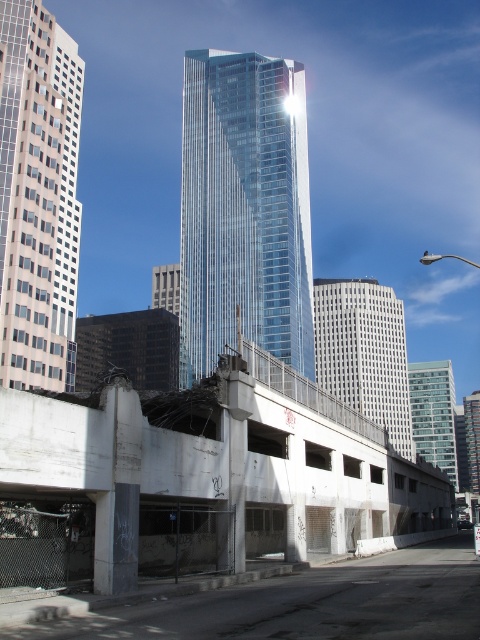
Question: Is concrete parking garage at center below white glass skyscraper at center?

Choices:
 (A) yes
 (B) no

Answer: (B)

Question: Which point is farther to the camera?

Choices:
 (A) (205, 132)
 (B) (435, 394)
 (C) (66, 128)
 (D) (71, 401)

Answer: (B)

Question: Is transparent glass skyscraper at center smaller than white glass skyscraper at center?

Choices:
 (A) yes
 (B) no

Answer: (A)

Question: Estimate the real-world distances between objects in this image. Which object is farther from the transparent glass skyscraper at center?

Choices:
 (A) glassy reflective skyscraper at center
 (B) concrete parking garage at center
 (C) white glass skyscraper at center

Answer: (B)

Question: Does concrete parking garage at center appear over white glass skyscraper at center?

Choices:
 (A) yes
 (B) no

Answer: (A)

Question: Which of the following is the closest to the observer?

Choices:
 (A) (146, 426)
 (B) (291, 362)
 (C) (446, 372)
 (D) (374, 369)

Answer: (A)